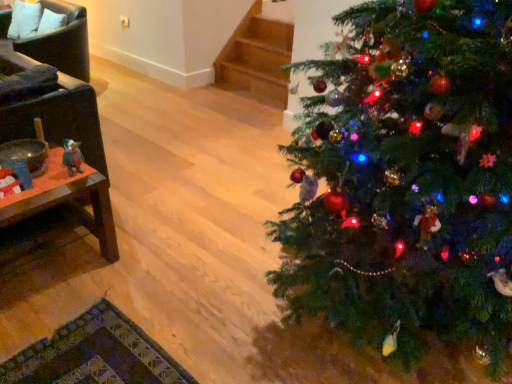
Image resolution: width=512 pixels, height=384 pixels. What are the coordinates of `space that is in front of woodenmaterial/texturetable at left` in the screenshot? It's located at coord(50,338).